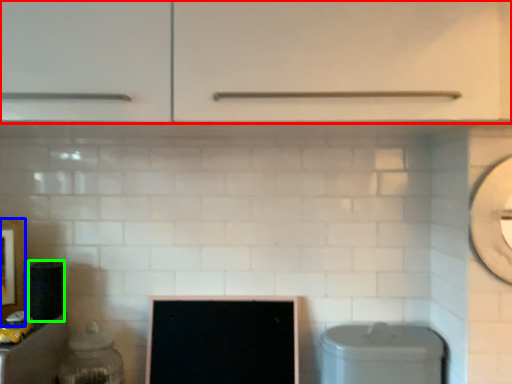
Question: Which is nearer to the cabinetry (highlighted by a red box)? picture frame (highlighted by a blue box) or appliance (highlighted by a green box).

Choices:
 (A) picture frame
 (B) appliance

Answer: (B)